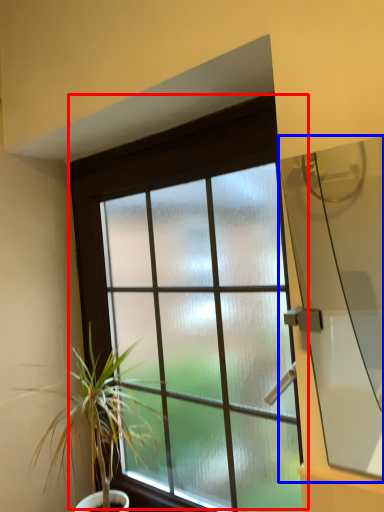
Question: Among these objects, which one is nearest to the camera, window (highlighted by a red box) or window screen (highlighted by a blue box)?

Choices:
 (A) window
 (B) window screen

Answer: (B)